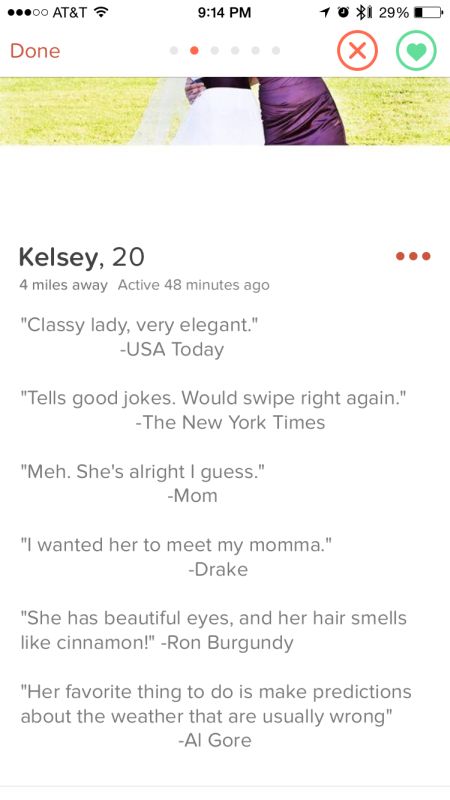
Image resolution: width=450 pixels, height=800 pixels. I want to click on purple fabric, so click(x=305, y=114), click(x=298, y=673).